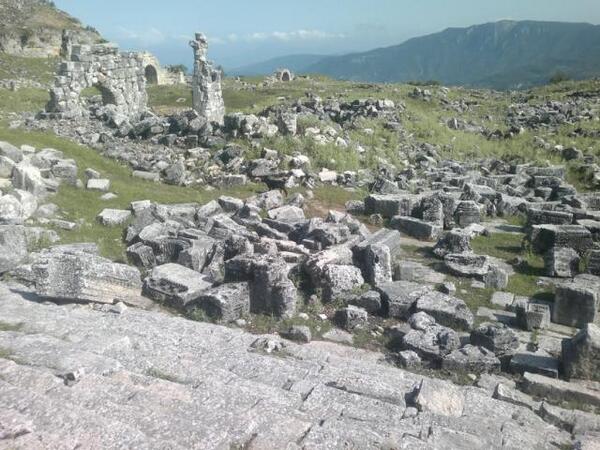
Where is `archways`? The width and height of the screenshot is (600, 450). archways is located at coordinates (104, 93), (148, 72), (286, 75).